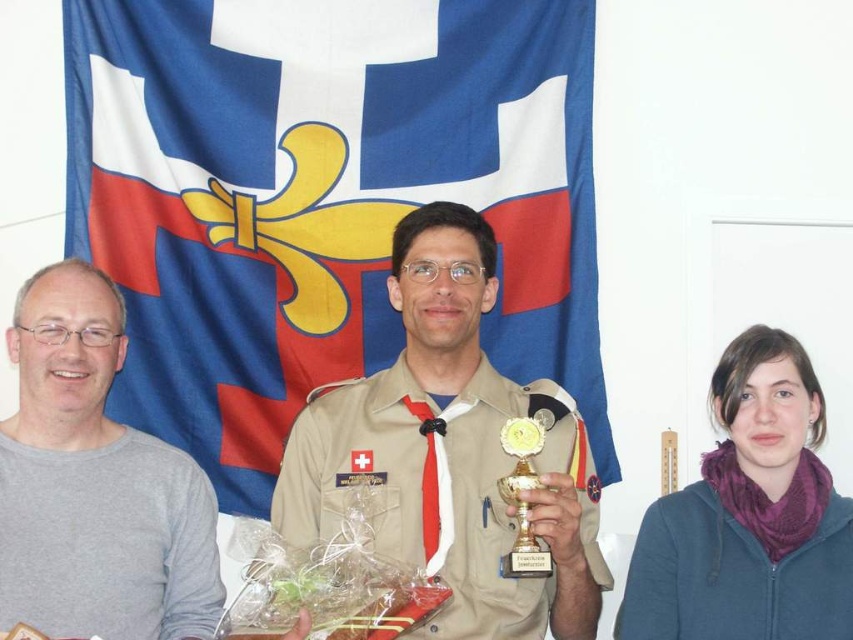
You are attending an award ceremony and see the blue fabric flag at upper center and the khaki uniform at center. Which object is positioned to the right side of the other?

The khaki uniform at center is positioned to the right of the blue fabric flag at upper center.

You are a photographer standing in front of the flag. You need to take a photo of the khaki uniform at center and the gray matte sweater at left. Based on their positions, which one is on the left side of the photo?

The gray matte sweater at left is on the left side of the photo because the khaki uniform at center is to the right of it.